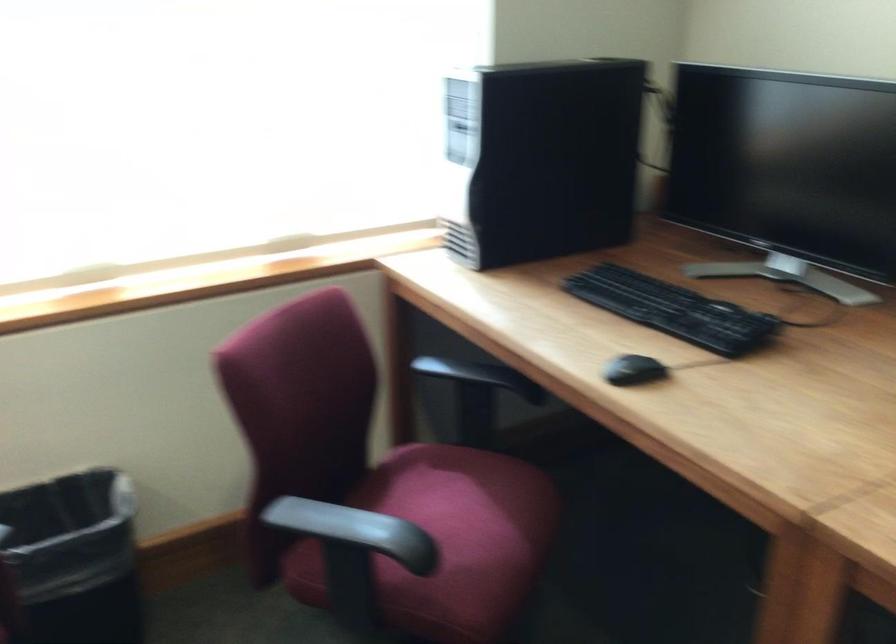
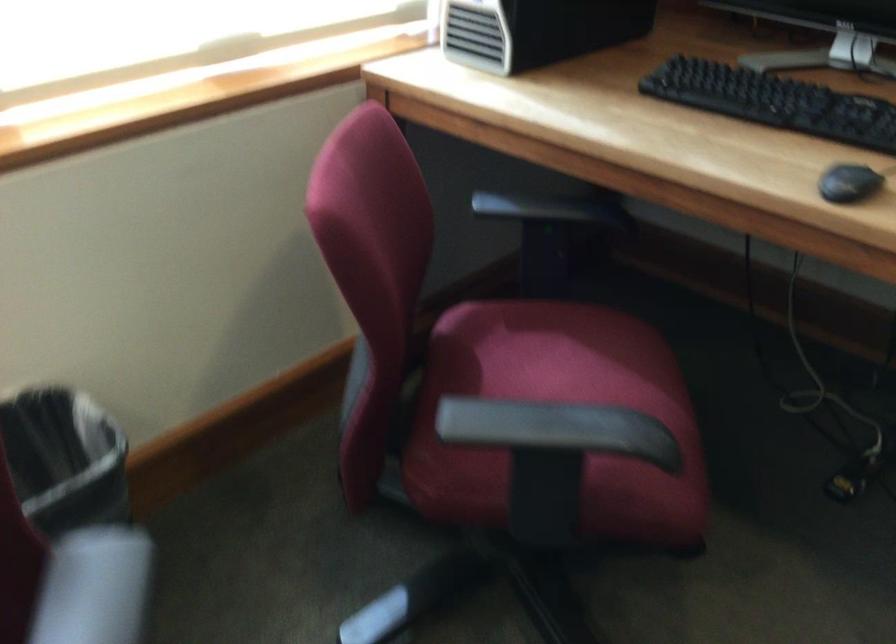
In the second image, find the point that corresponds to pixel 349 520 in the first image.

(556, 415)